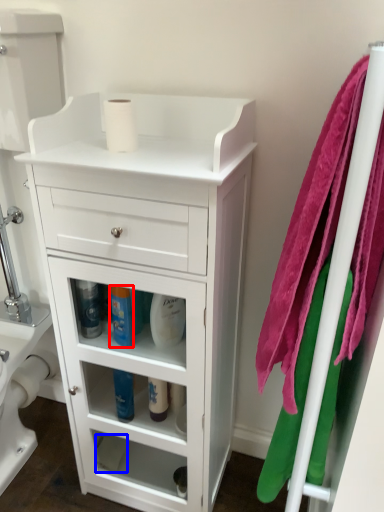
Question: Which object is further to the camera taking this photo, cleaning product (highlighted by a red box) or toilet paper (highlighted by a blue box)?

Choices:
 (A) cleaning product
 (B) toilet paper

Answer: (B)